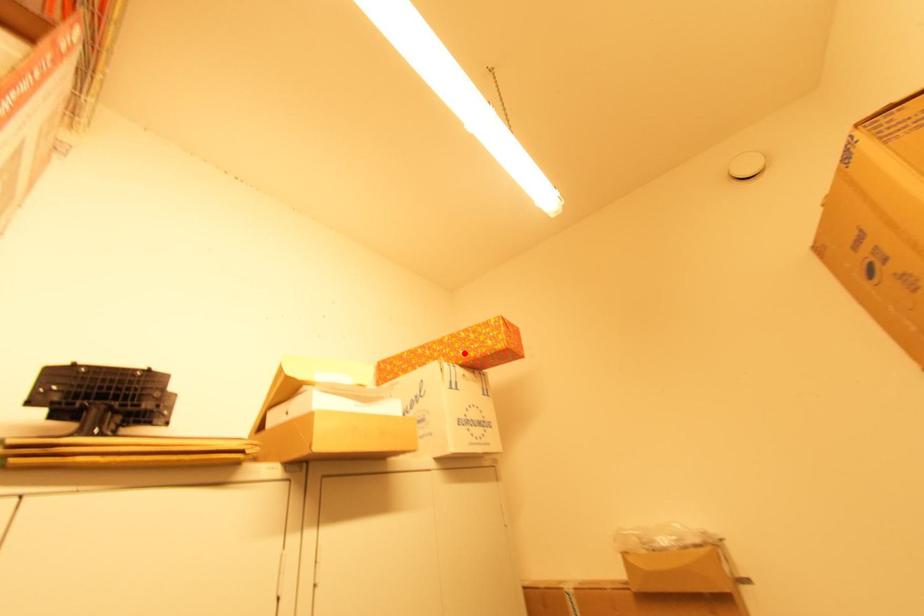
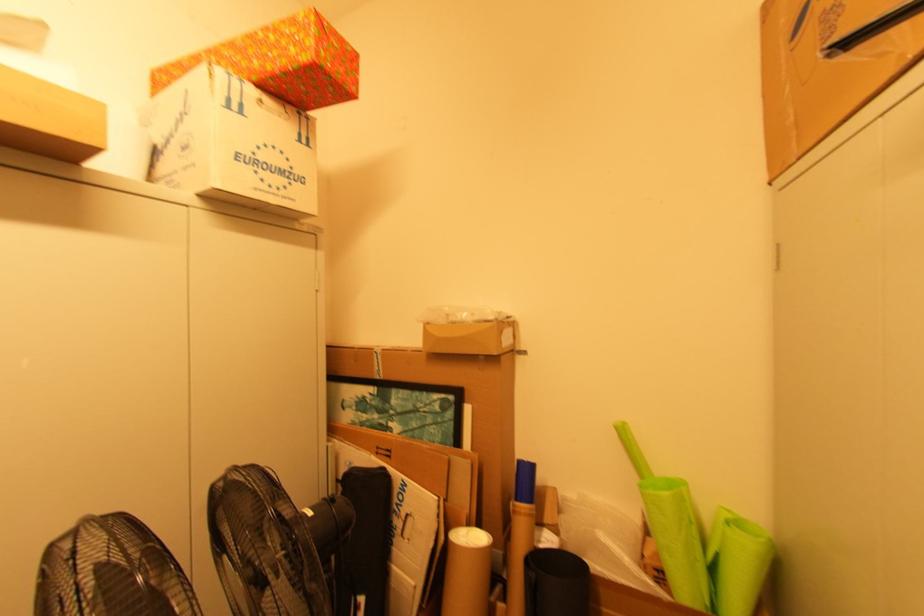
The point at the highlighted location is marked in the first image. Where is the corresponding point in the second image?

(258, 63)